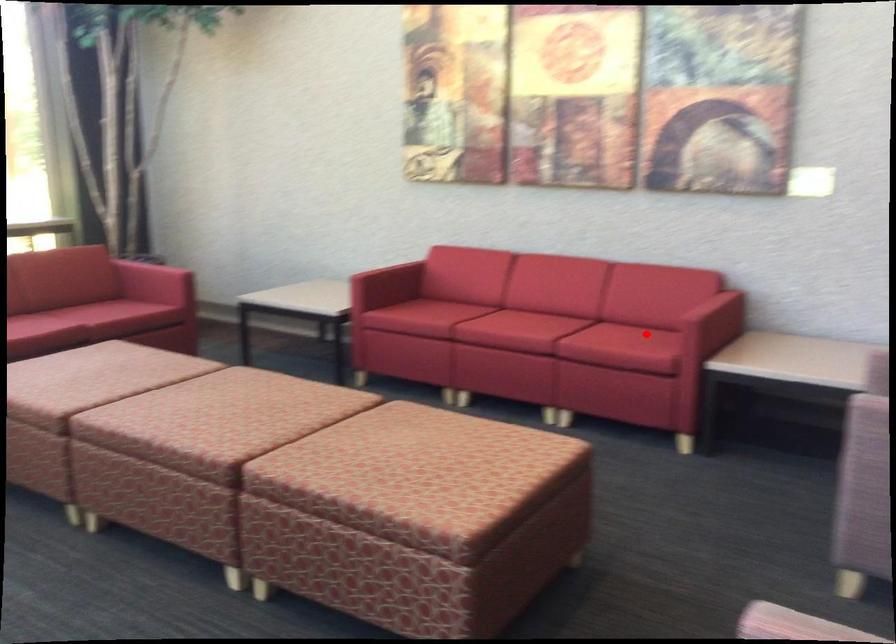
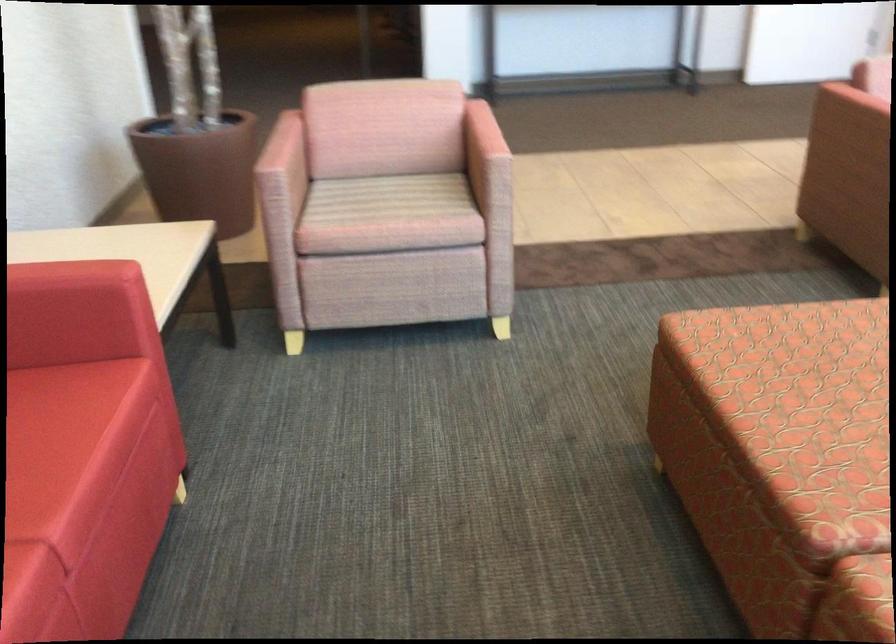
Find the pixel in the second image that matches the highlighted location in the first image.

(38, 408)